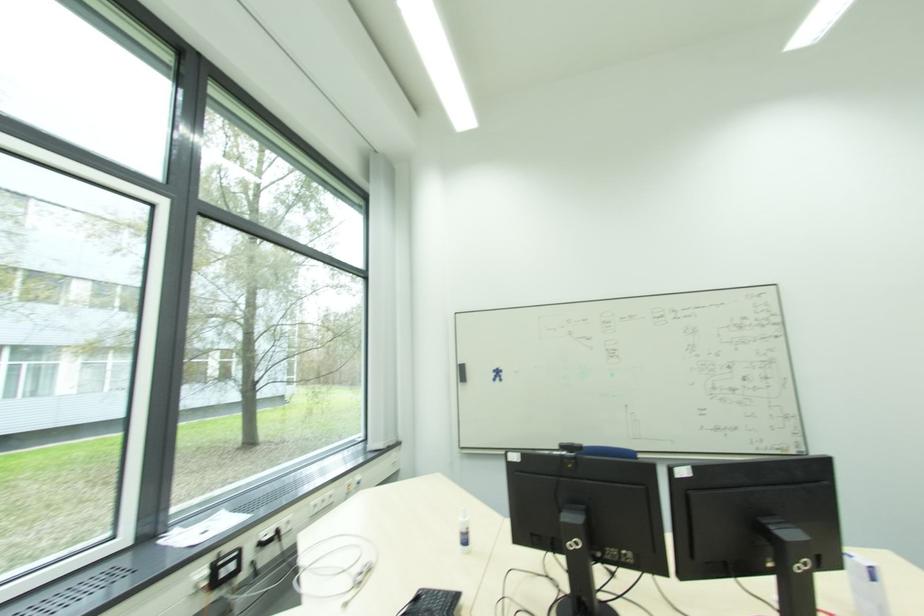
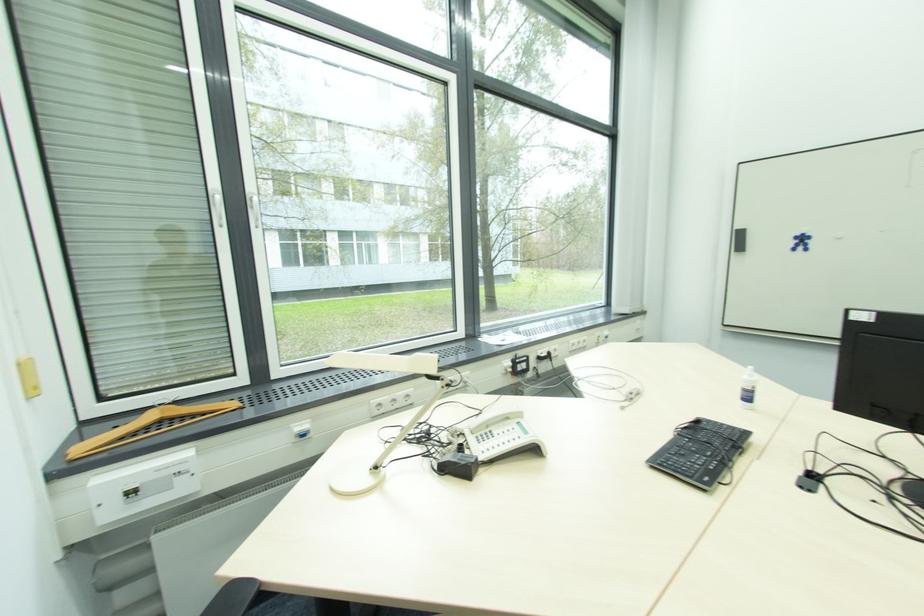
First-person continuous shooting, in which direction is the camera rotating?

The camera's rotation is toward left-down.